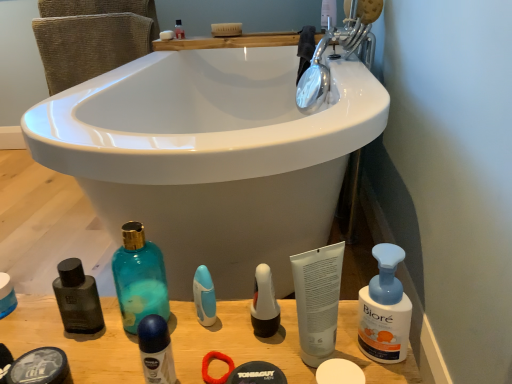
Locate an element on the screen. The height and width of the screenshot is (384, 512). vacant area that lies between white glossy pump bottle at center, which is the third toiletry from top to bottom, and teal glass bottle at lower left, positioned as the second cleaning product in right-to-left order is located at coordinates (216, 321).